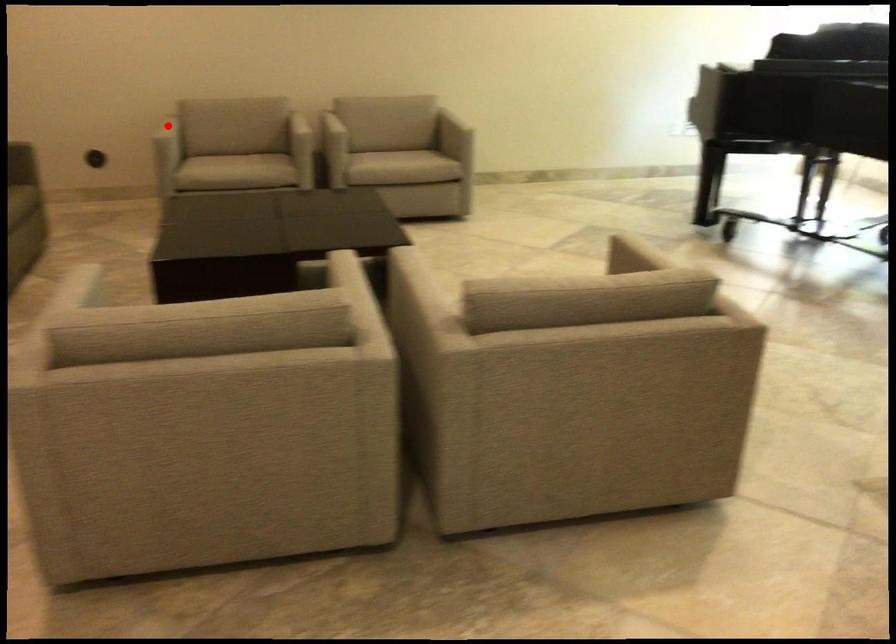
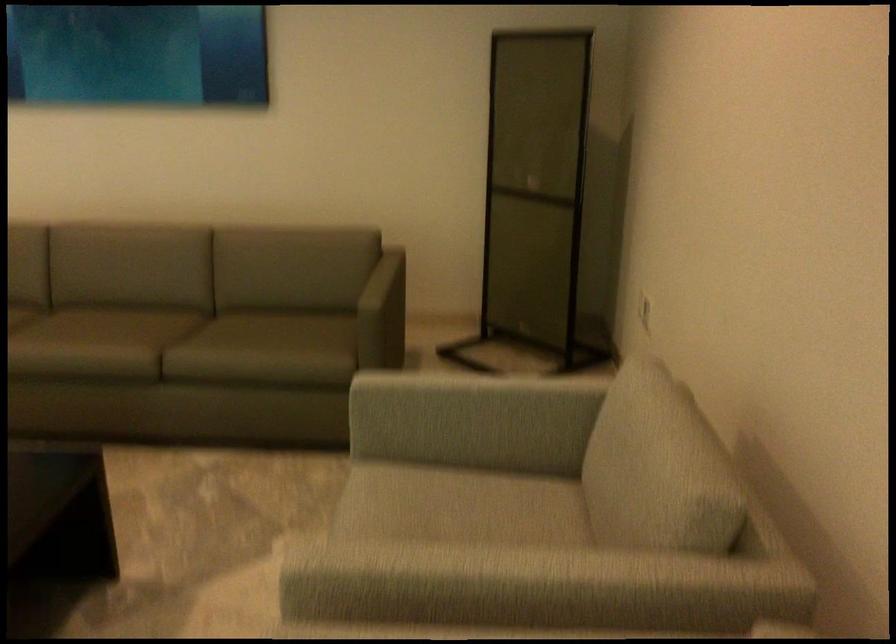
Where in the second image is the point corresponding to the highlighted location from the first image?

(469, 399)